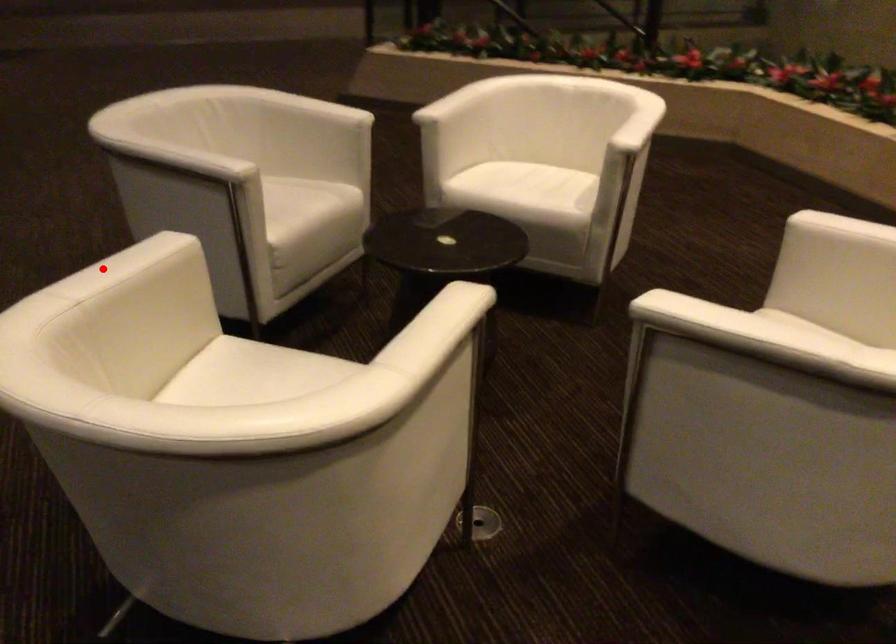
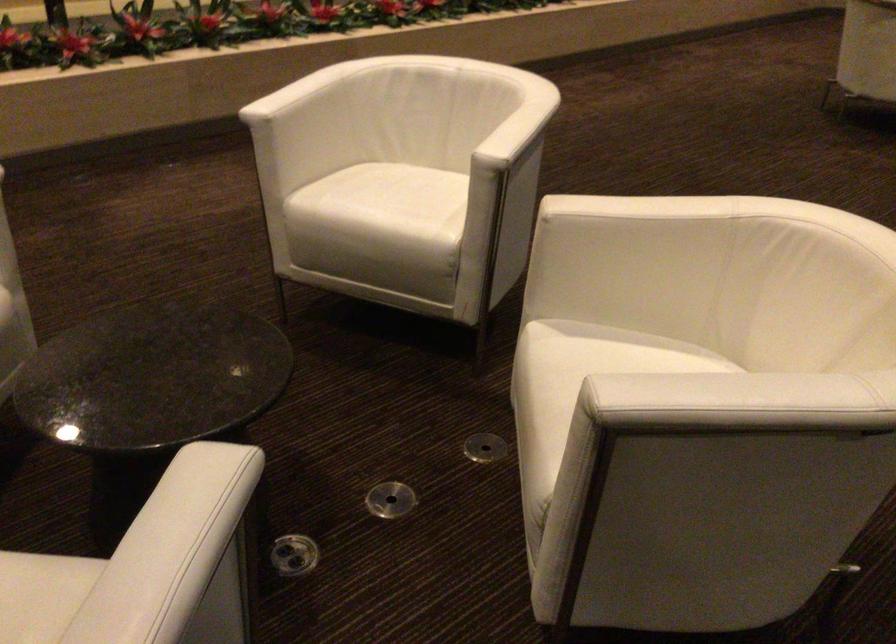
Question: I am providing you with two images of the same scene from different viewpoints. In image1, a red point is highlighted. Considering the same 3D point in image2, which of the following is correct?

Choices:
 (A) It is closer
 (B) It is farther

Answer: (A)